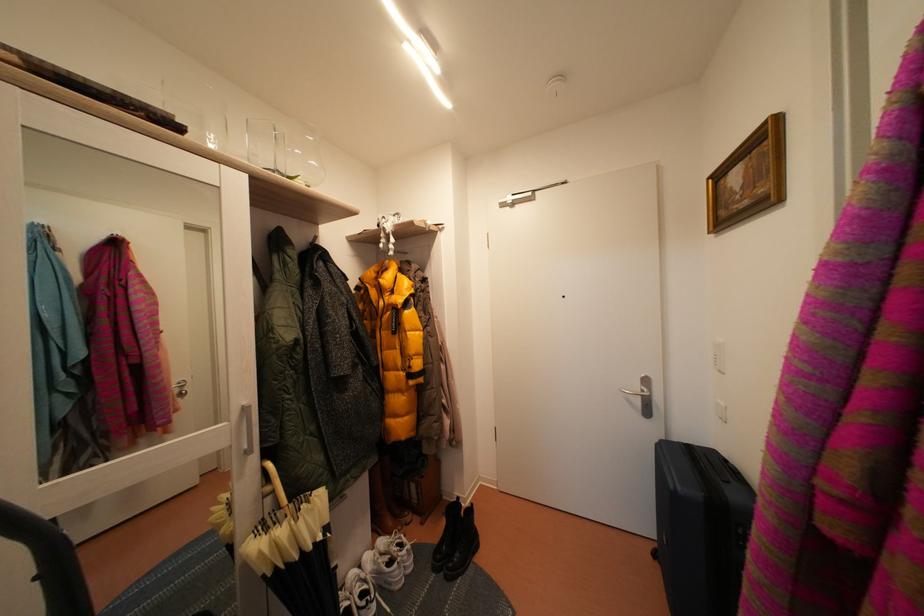
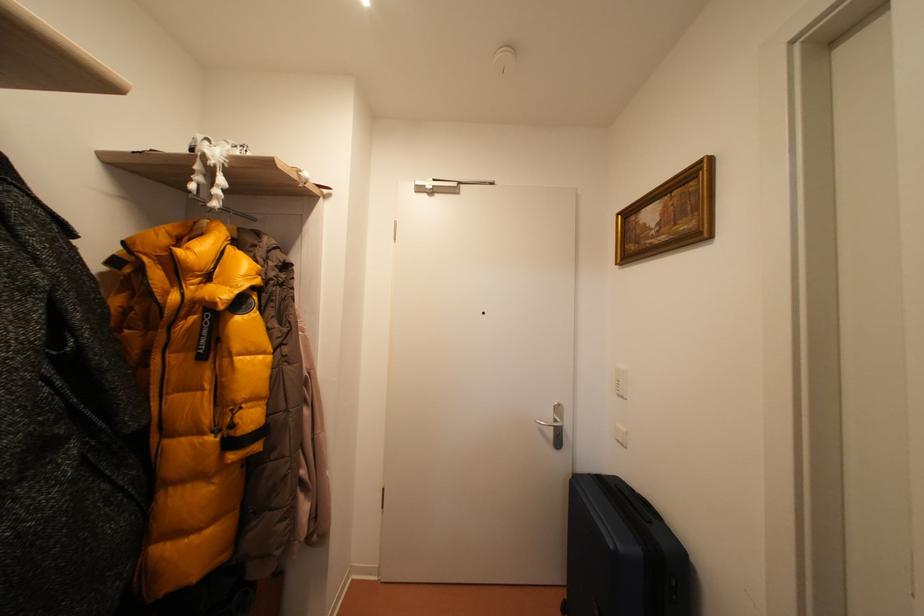
Question: Based on the continuous images, in which direction is the camera rotating? Reply with the corresponding letter.

Choices:
 (A) Left
 (B) Right
 (C) Up
 (D) Down

Answer: (B)